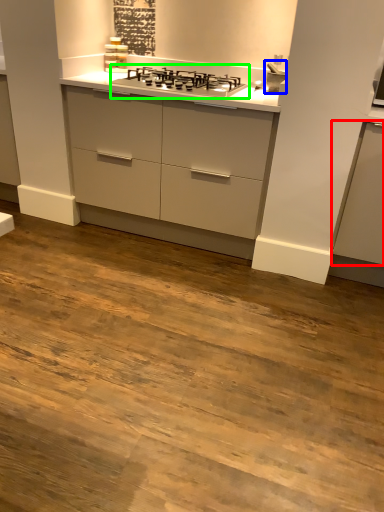
Question: Which is nearer to the cabinetry (highlighted by a red box)? sink (highlighted by a blue box) or gas stove (highlighted by a green box).

Choices:
 (A) sink
 (B) gas stove

Answer: (A)